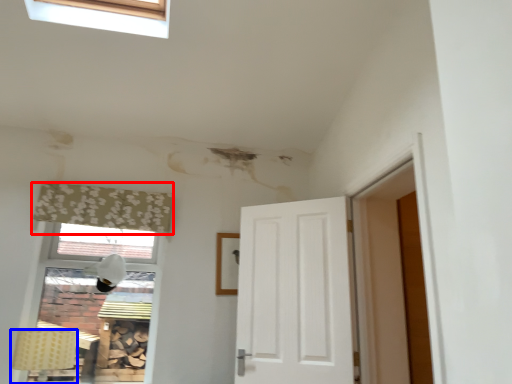
Question: Which point is closer to the camera, curtain (highlighted by a red box) or lamp (highlighted by a blue box)?

Choices:
 (A) curtain
 (B) lamp

Answer: (B)